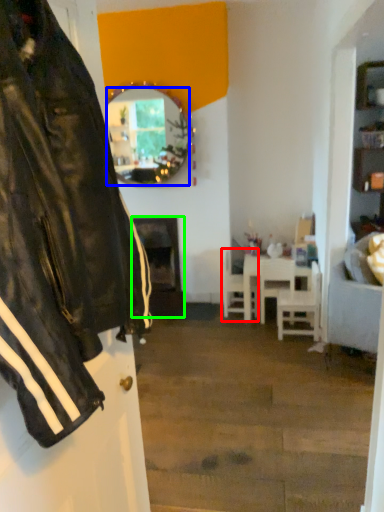
Question: Estimate the real-world distances between objects in this image. Which object is closer to chair (highlighted by a red box), mirror (highlighted by a blue box) or fireplace (highlighted by a green box)?

Choices:
 (A) mirror
 (B) fireplace

Answer: (B)